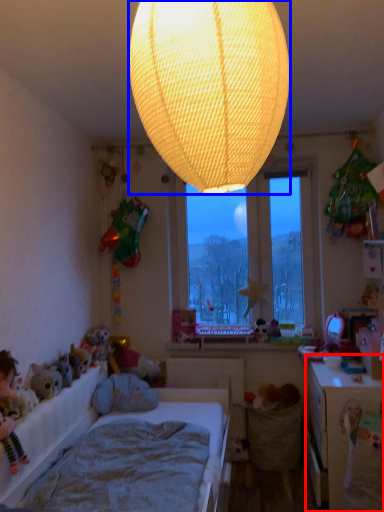
Question: Which object is further to the camera taking this photo, table (highlighted by a red box) or lamp (highlighted by a blue box)?

Choices:
 (A) table
 (B) lamp

Answer: (A)